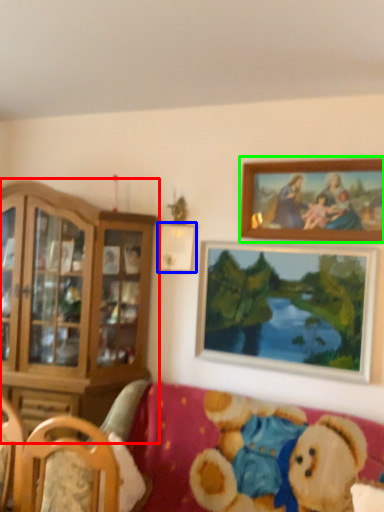
Question: Considering the real-world distances, which object is closest to cabinetry (highlighted by a red box)? picture frame (highlighted by a blue box) or picture frame (highlighted by a green box).

Choices:
 (A) picture frame
 (B) picture frame

Answer: (A)